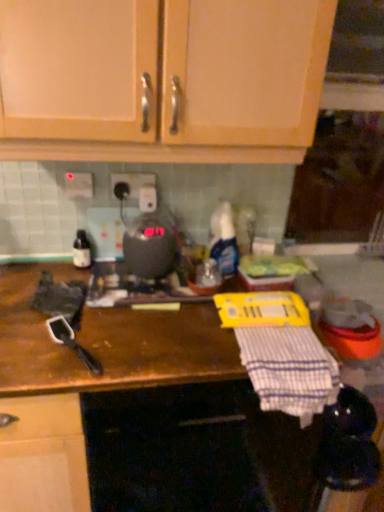
Identify the location of free space in front of metallic gray toaster at center. The image size is (384, 512). (150, 314).